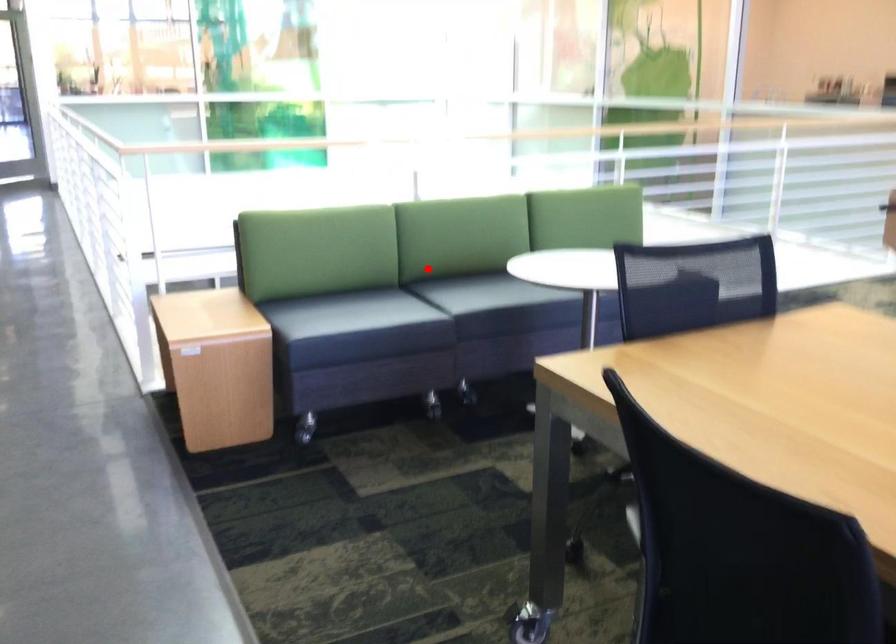
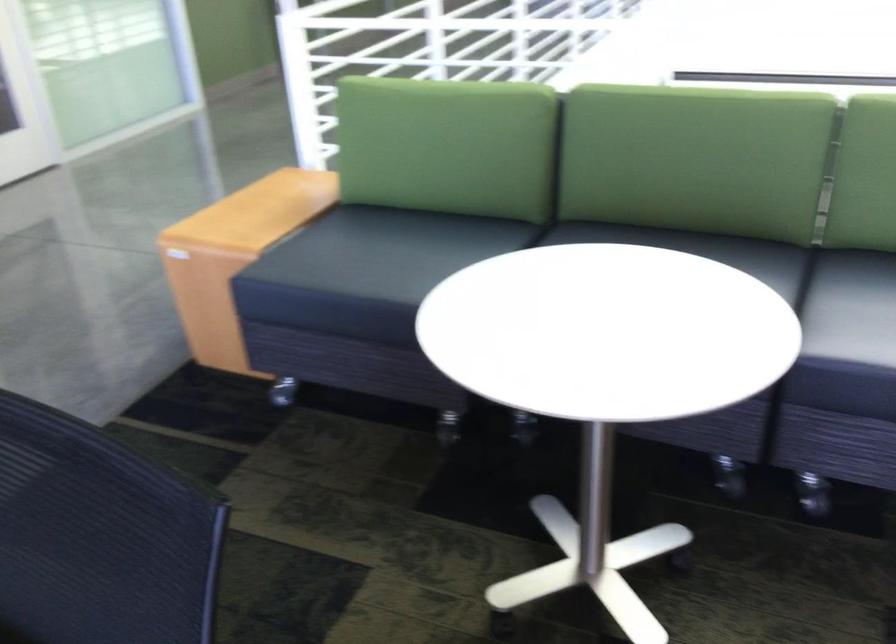
Locate, in the second image, the point that corresponds to the highlighted location in the first image.

(702, 250)